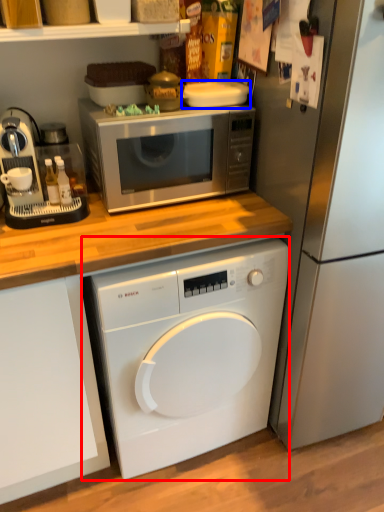
Question: Which of the following is the farthest to the observer, washing machine (highlighted by a red box) or appliance (highlighted by a blue box)?

Choices:
 (A) washing machine
 (B) appliance

Answer: (B)